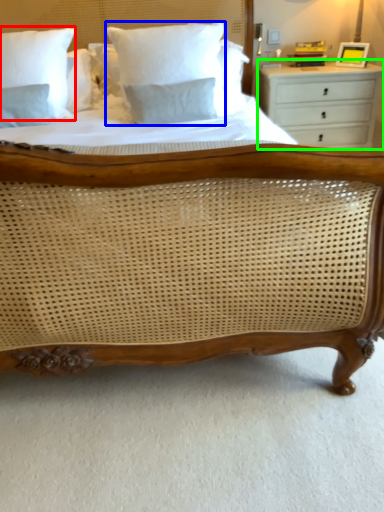
Question: Based on their relative distances, which object is nearer to pillow (highlighted by a red box)? Choose from pillow (highlighted by a blue box) and chest of drawers (highlighted by a green box).

Choices:
 (A) pillow
 (B) chest of drawers

Answer: (A)